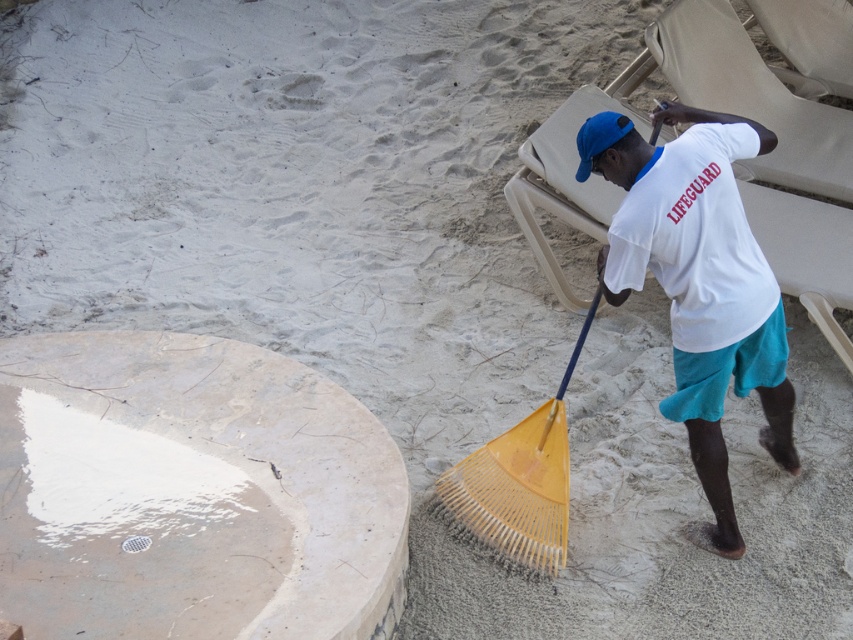
Question: Does yellow plastic rake at center appear over blue fabric baseball cap at upper center?

Choices:
 (A) no
 (B) yes

Answer: (A)

Question: Which point is closer to the camera taking this photo?

Choices:
 (A) (73, 403)
 (B) (608, 118)
 (C) (537, 168)

Answer: (B)

Question: Based on their relative distances, which object is nearer to the blue fabric baseball cap at upper center?

Choices:
 (A) yellow plastic rake at center
 (B) white marble cement at lower left
 (C) white cotton shirt at center
 (D) beige fabric beach chair at upper right

Answer: (C)

Question: Can you confirm if white cotton shirt at center is positioned below blue fabric baseball cap at upper center?

Choices:
 (A) no
 (B) yes

Answer: (B)

Question: Can you confirm if white marble cement at lower left is positioned above white cotton shirt at center?

Choices:
 (A) yes
 (B) no

Answer: (B)

Question: Which point is farther to the camera?

Choices:
 (A) beige fabric beach chair at upper right
 (B) white marble cement at lower left
 (C) blue fabric baseball cap at upper center
 (D) yellow plastic rake at center

Answer: (A)